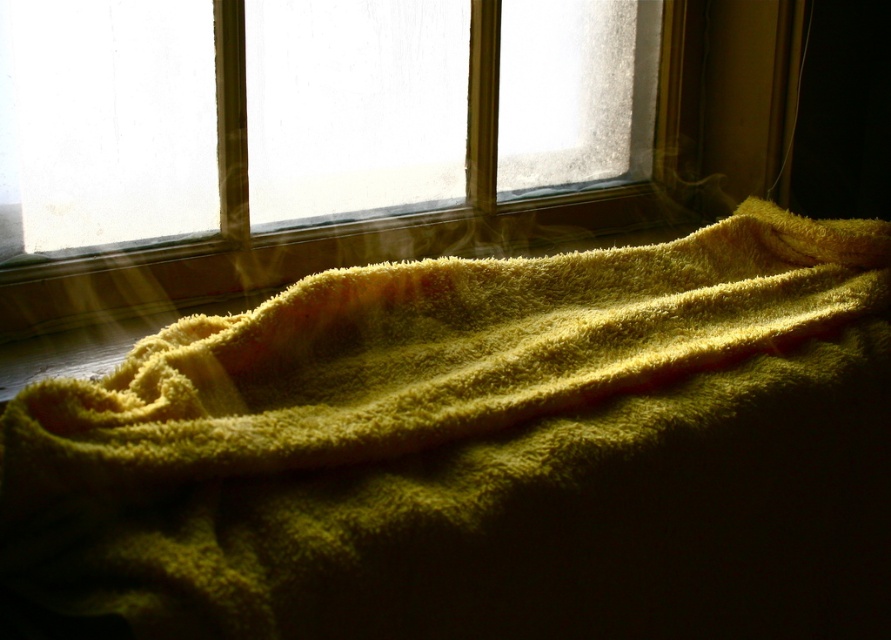
You are organizing a space and need to place a small plant pot between the yellow fuzzy towel at center and the translucent glass window at upper center. Based on their positions, where should you place the pot to ensure it is between them?

The yellow fuzzy towel at center is to the right of the translucent glass window at upper center, so placing the pot between them would require positioning it to the right of the window and to the left of the towel.

You are trying to decide whether to place a small potted plant between the yellow fuzzy towel at center and the translucent glass window at upper center. Which object should the plant be closer to if you want it to receive more light?

The translucent glass window at upper center allows more light to pass through than the yellow fuzzy towel at center, so placing the plant closer to the translucent glass window at upper center would provide it with more light.